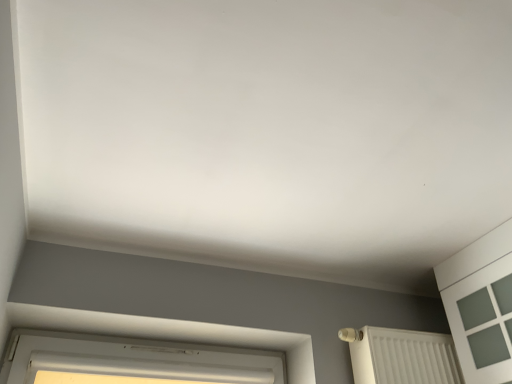
Question: Is white plastic window at lower left with white textured radiator at lower right?

Choices:
 (A) no
 (B) yes

Answer: (A)

Question: Does white plastic window at lower left turn towards white textured radiator at lower right?

Choices:
 (A) yes
 (B) no

Answer: (B)

Question: Is white plastic window at lower left positioned behind white textured radiator at lower right?

Choices:
 (A) no
 (B) yes

Answer: (A)

Question: Is white plastic window at lower left far from white textured radiator at lower right?

Choices:
 (A) yes
 (B) no

Answer: (B)

Question: Can you confirm if white plastic window at lower left is taller than white textured radiator at lower right?

Choices:
 (A) no
 (B) yes

Answer: (A)

Question: Considering the relative positions of white plastic window at lower left and white textured radiator at lower right in the image provided, is white plastic window at lower left in front of white textured radiator at lower right?

Choices:
 (A) yes
 (B) no

Answer: (A)

Question: From a real-world perspective, does white textured radiator at lower right sit lower than white plastic window at lower left?

Choices:
 (A) no
 (B) yes

Answer: (A)

Question: Can you confirm if white textured radiator at lower right is shorter than white plastic window at lower left?

Choices:
 (A) yes
 (B) no

Answer: (B)

Question: Is white textured radiator at lower right looking in the opposite direction of white plastic window at lower left?

Choices:
 (A) yes
 (B) no

Answer: (B)

Question: Is white textured radiator at lower right outside of white plastic window at lower left?

Choices:
 (A) no
 (B) yes

Answer: (B)

Question: Is white textured radiator at lower right oriented towards white plastic window at lower left?

Choices:
 (A) no
 (B) yes

Answer: (A)

Question: Can you confirm if white textured radiator at lower right is thinner than white plastic window at lower left?

Choices:
 (A) no
 (B) yes

Answer: (A)

Question: Looking at their shapes, would you say white textured radiator at lower right is wider or thinner than white plastic window at lower left?

Choices:
 (A) wide
 (B) thin

Answer: (A)